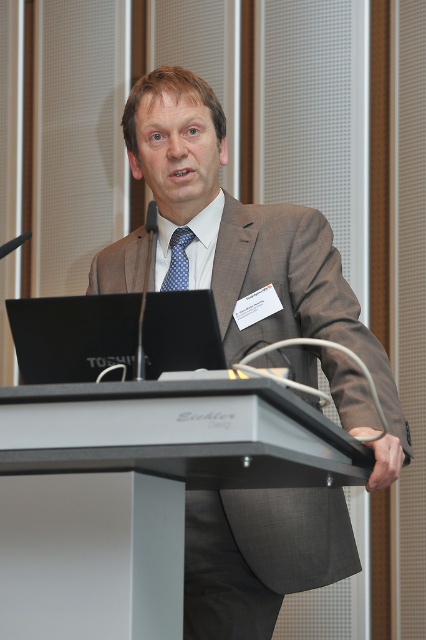
Question: Estimate the real-world distances between objects in this image. Which object is closer to the metallic gray podium at center?

Choices:
 (A) black glossy laptop at center
 (B) blue silk tie at center
 (C) matte gray suit at center

Answer: (A)

Question: Where is matte gray suit at center located in relation to black glossy laptop at center in the image?

Choices:
 (A) left
 (B) right

Answer: (B)

Question: Does metallic gray podium at center have a larger size compared to blue silk tie at center?

Choices:
 (A) yes
 (B) no

Answer: (A)

Question: Can you confirm if matte gray suit at center is positioned above blue silk tie at center?

Choices:
 (A) yes
 (B) no

Answer: (B)

Question: Which point appears farthest from the camera in this image?

Choices:
 (A) (91, 449)
 (B) (86, 330)

Answer: (B)

Question: Which of the following is the closest to the observer?

Choices:
 (A) blue silk tie at center
 (B) metallic gray podium at center
 (C) matte gray suit at center

Answer: (B)